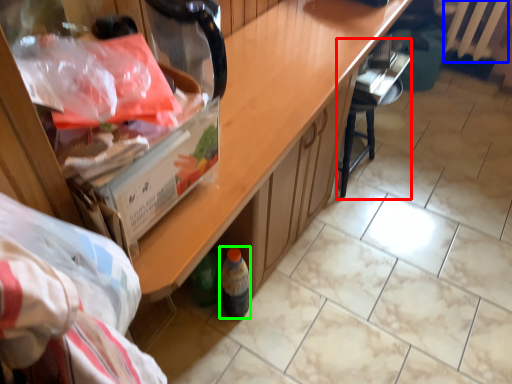
Question: Which is nearer to the chair (highlighted by a red box)? radiator (highlighted by a blue box) or wine bottle (highlighted by a green box).

Choices:
 (A) radiator
 (B) wine bottle

Answer: (B)